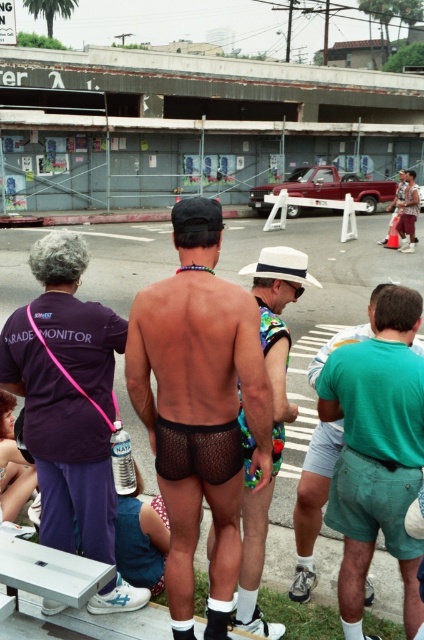
Based on the photo, you are a photographer trying to capture a clear shot of the black mesh shorts at center and the white plastic picnic table at lower left. Based on their heights, which object should you focus on first to ensure both are in frame?

The black mesh shorts at center is taller than the white plastic picnic table at lower left, so you should focus on the taller black mesh shorts at center first to ensure both are in frame.

You are a fashion designer observing the crowd and need to determine which pair of shorts, the black mesh shorts at center or the fishnet shorts at center, takes up more visual space in the image. Based on the description, which one is larger?

The fishnet shorts at center takes up more visual space than the black mesh shorts at center because the black mesh shorts at center occupies less space than fishnet shorts at center.